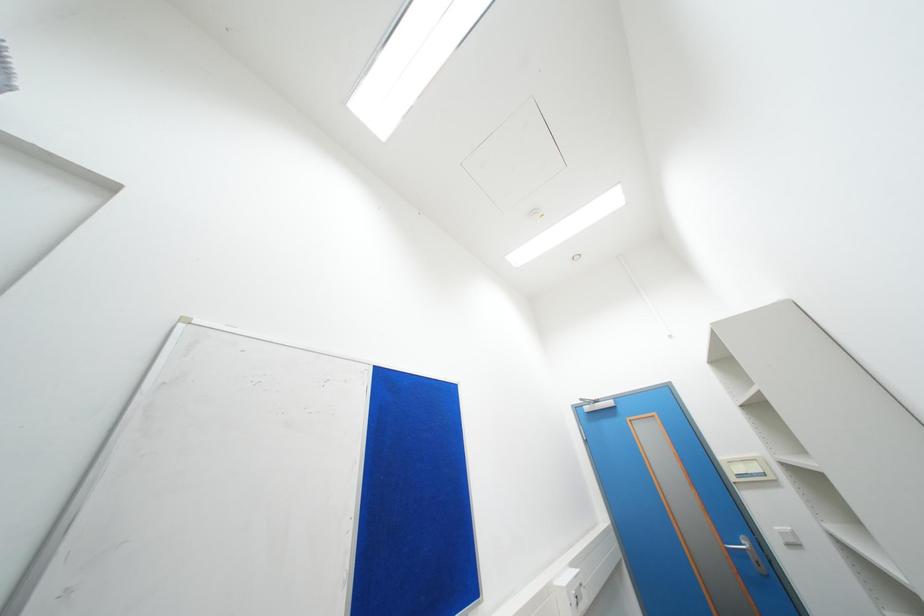
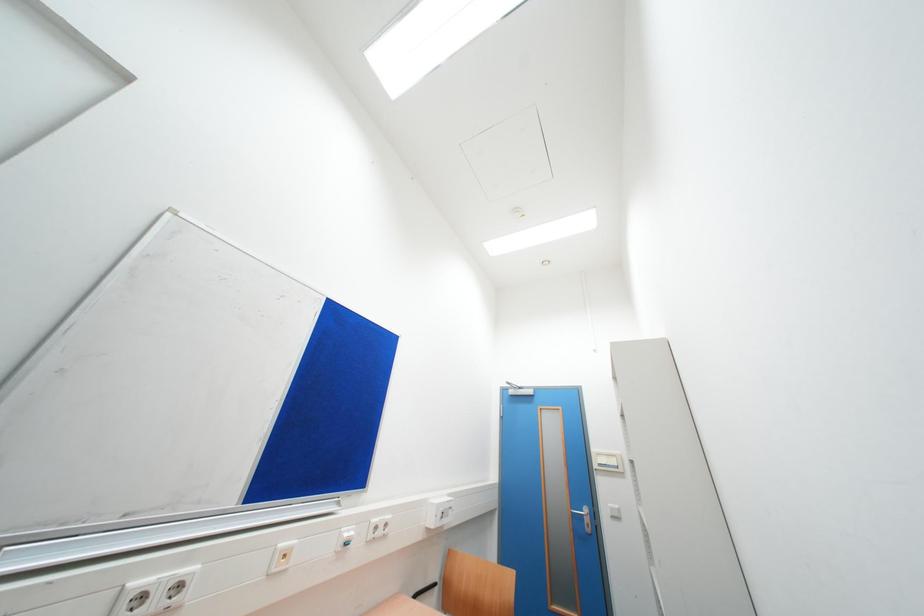
Question: The camera is either moving clockwise (left) or counter-clockwise (right) around the object. The first image is from the beginning of the video and the second image is from the end. Is the camera moving left or right when shooting the video?

Choices:
 (A) Left
 (B) Right

Answer: (A)